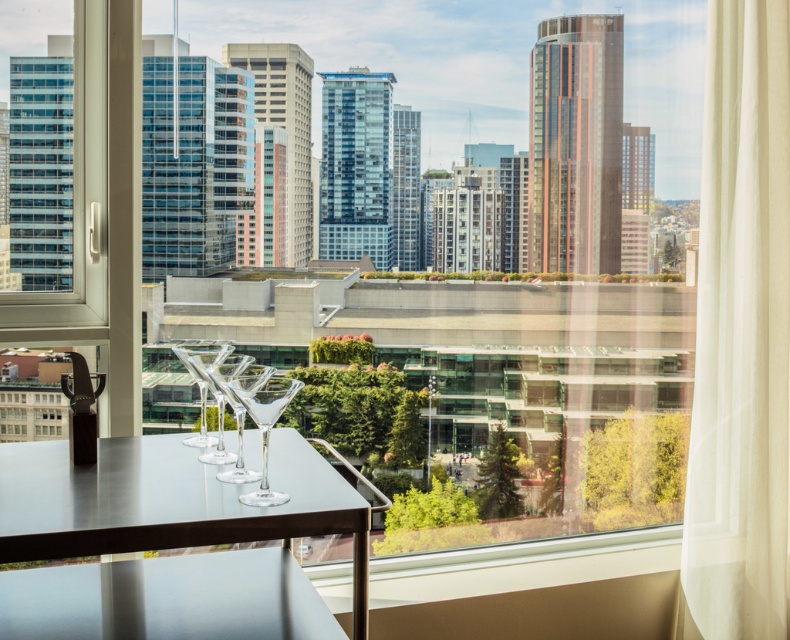
You are an interior designer assessing the lighting in a highrise office. You notice the white sheer curtain at right and the transparent glass window at left. Which object allows more natural light into the room?

The transparent glass window at left allows more natural light into the room because it is not obstructed by the curtain, even though the white sheer curtain at right is taller.

You are a photographer setting up equipment in a modern office. You have a white sheer curtain at right and a clear glass wine glass at center in your frame. Which object is wider?

The white sheer curtain at right is wider than the clear glass wine glass at center.

You are standing inside the high rise building looking at the scene. You see a point at coordinates (740, 333). What object is located at that point?

The point at coordinates (740, 333) corresponds to the white sheer curtain at right.